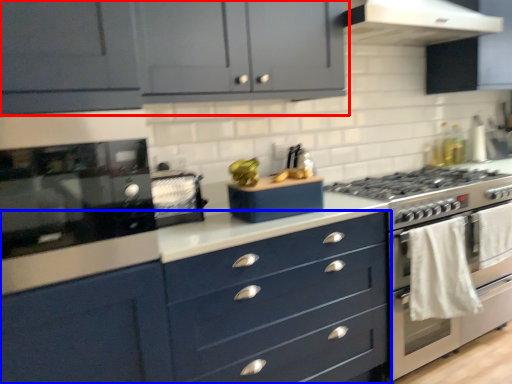
Question: Which object is closer to the camera taking this photo, cabinetry (highlighted by a red box) or chest of drawers (highlighted by a blue box)?

Choices:
 (A) cabinetry
 (B) chest of drawers

Answer: (B)